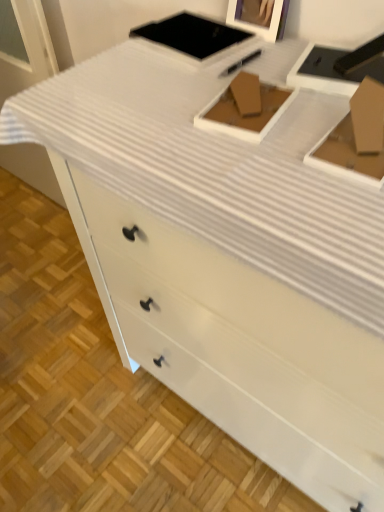
At what (x,y) coordinates should I click in order to perform the action: click on brown cardboard box at center. Please return your answer as a coordinate pair (x, y). Image resolution: width=384 pixels, height=512 pixels. Looking at the image, I should click on (246, 115).

Image resolution: width=384 pixels, height=512 pixels. What do you see at coordinates (246, 115) in the screenshot?
I see `brown cardboard box at center` at bounding box center [246, 115].

What is the approximate width of brown cardboard box at center?

6.47 inches.

This screenshot has height=512, width=384. What are the coordinates of `wooden picture frame at upper center` in the screenshot? It's located at 259,17.

Describe the element at coordinates (259, 17) in the screenshot. I see `wooden picture frame at upper center` at that location.

Identify the location of brown cardboard box at center. (246, 115).

Considering the positions of objects wooden picture frame at upper center and brown cardboard box at center in the image provided, who is more to the left, wooden picture frame at upper center or brown cardboard box at center?

brown cardboard box at center.

Which is behind, wooden picture frame at upper center or brown cardboard box at center?

wooden picture frame at upper center.

Does point (268, 36) appear closer or farther from the camera than point (286, 106)?

Point (268, 36) is positioned farther from the camera compared to point (286, 106).

From the image's perspective, is wooden picture frame at upper center positioned above or below brown cardboard box at center?

Clearly, from the image's perspective, wooden picture frame at upper center is above brown cardboard box at center.

From a real-world perspective, does wooden picture frame at upper center stand above brown cardboard box at center?

Yes.

Which object is wider, wooden picture frame at upper center or brown cardboard box at center?

Wider between the two is brown cardboard box at center.

Is wooden picture frame at upper center taller than brown cardboard box at center?

Indeed, wooden picture frame at upper center has a greater height compared to brown cardboard box at center.

Who is bigger, wooden picture frame at upper center or brown cardboard box at center?

With larger size is wooden picture frame at upper center.

Is wooden picture frame at upper center spatially inside brown cardboard box at center, or outside of it?

wooden picture frame at upper center lies outside brown cardboard box at center.

Is the surface of wooden picture frame at upper center in direct contact with brown cardboard box at center?

wooden picture frame at upper center and brown cardboard box at center are not in contact.

In the scene shown: Could you tell me if wooden picture frame at upper center is turned towards brown cardboard box at center?

No, wooden picture frame at upper center does not turn towards brown cardboard box at center.

What's the angular difference between wooden picture frame at upper center and brown cardboard box at center's facing directions?

8.52 degrees.

Locate an element on the screen. The height and width of the screenshot is (512, 384). picture frame located above the brown cardboard box at center (from a real-world perspective) is located at coordinates (259, 17).

From the picture: Which is more to the left, brown cardboard box at center or wooden picture frame at upper center?

From the viewer's perspective, brown cardboard box at center appears more on the left side.

Does brown cardboard box at center come behind wooden picture frame at upper center?

No.

Which point is more forward, (x=270, y=123) or (x=276, y=13)?

The point (x=270, y=123) is more forward.

Based on the photo, from the image's perspective, which is above, brown cardboard box at center or wooden picture frame at upper center?

wooden picture frame at upper center, from the image's perspective.

From a real-world perspective, is brown cardboard box at center positioned under wooden picture frame at upper center based on gravity?

Yes, from a real-world perspective, brown cardboard box at center is beneath wooden picture frame at upper center.

Considering the sizes of brown cardboard box at center and wooden picture frame at upper center in the image, is brown cardboard box at center wider or thinner than wooden picture frame at upper center?

brown cardboard box at center is wider than wooden picture frame at upper center.

Considering the sizes of objects brown cardboard box at center and wooden picture frame at upper center in the image provided, who is taller, brown cardboard box at center or wooden picture frame at upper center?

wooden picture frame at upper center is taller.

Is brown cardboard box at center smaller than wooden picture frame at upper center?

Yes.

From the picture: Is brown cardboard box at center completely or partially outside of wooden picture frame at upper center?

Yes.

Is brown cardboard box at center not close to wooden picture frame at upper center?

No.

Could you tell me if brown cardboard box at center is facing wooden picture frame at upper center?

No, brown cardboard box at center is not aimed at wooden picture frame at upper center.

Measure the distance from brown cardboard box at center to wooden picture frame at upper center.

They are 28.77 centimeters apart.

The image size is (384, 512). What are the coordinates of `picture frame on the right of brown cardboard box at center` in the screenshot? It's located at (259, 17).

Image resolution: width=384 pixels, height=512 pixels. What are the coordinates of `box in front of the wooden picture frame at upper center` in the screenshot? It's located at (246, 115).

I want to click on picture frame on the right of brown cardboard box at center, so click(259, 17).